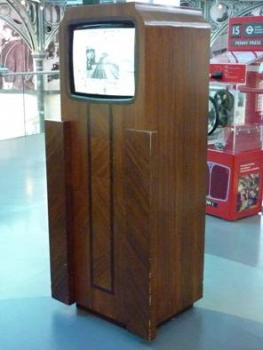
Locate an element on the screen. decorative line in wooden box is located at coordinates (111, 127), (87, 138).